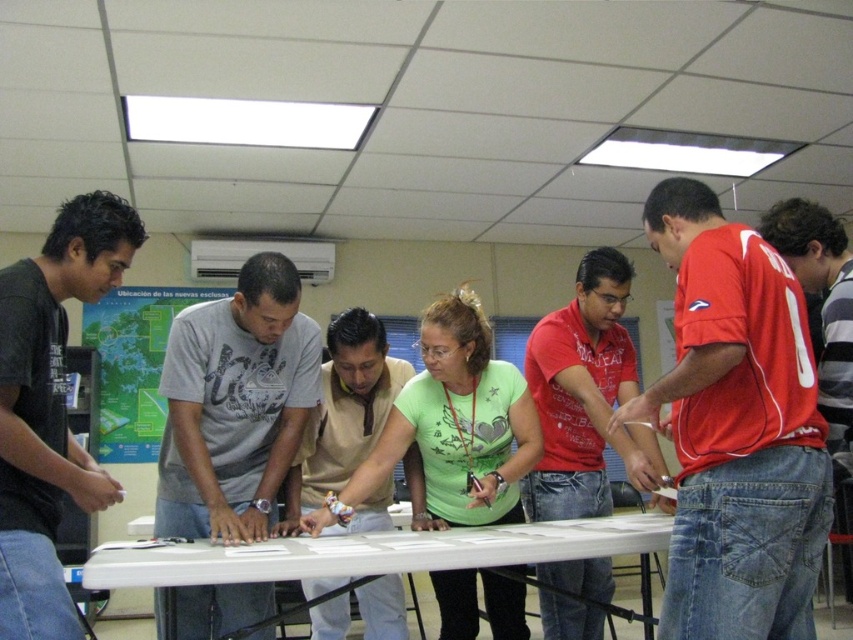
Is red jersey at center below beige cotton shirt at center?

Actually, red jersey at center is above beige cotton shirt at center.

Can you confirm if red jersey at center is smaller than beige cotton shirt at center?

No.

Is point (770, 250) farther from camera compared to point (323, 486)?

No, it is not.

Where is `red jersey at center`? The height and width of the screenshot is (640, 853). red jersey at center is located at coordinates (735, 428).

Does gray cotton t-shirt at center have a lesser width compared to green matte shirt at center?

Yes, gray cotton t-shirt at center is thinner than green matte shirt at center.

The height and width of the screenshot is (640, 853). What do you see at coordinates (235, 404) in the screenshot? I see `gray cotton t-shirt at center` at bounding box center [235, 404].

This screenshot has height=640, width=853. Identify the location of gray cotton t-shirt at center. (235, 404).

Which is in front, point (698, 492) or point (631, 529)?

Point (698, 492)

Is point (688, 371) positioned behind point (271, 564)?

No, it is in front of (271, 564).

Which is behind, point (773, 305) or point (103, 557)?

The point (103, 557) is behind.

Where is `red jersey at center`? red jersey at center is located at coordinates (735, 428).